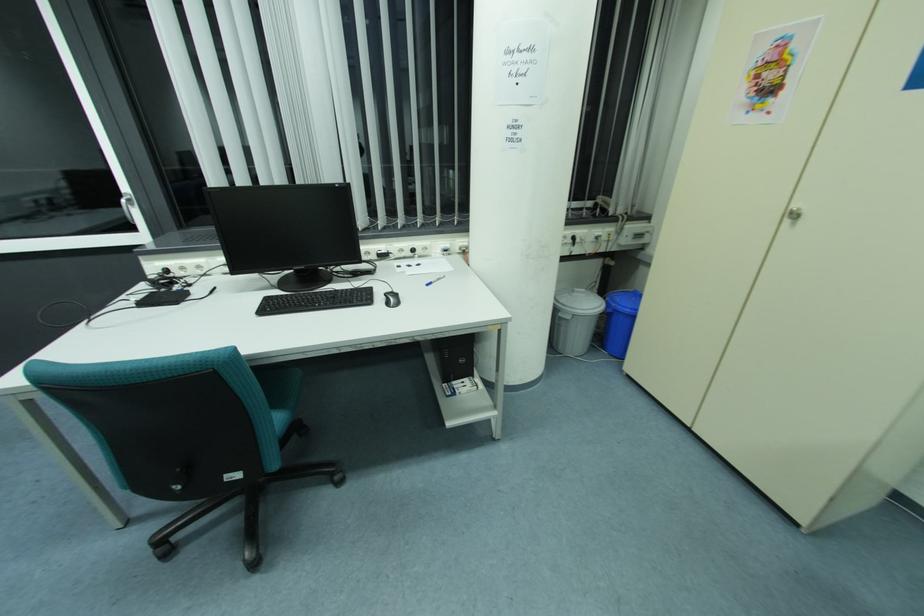
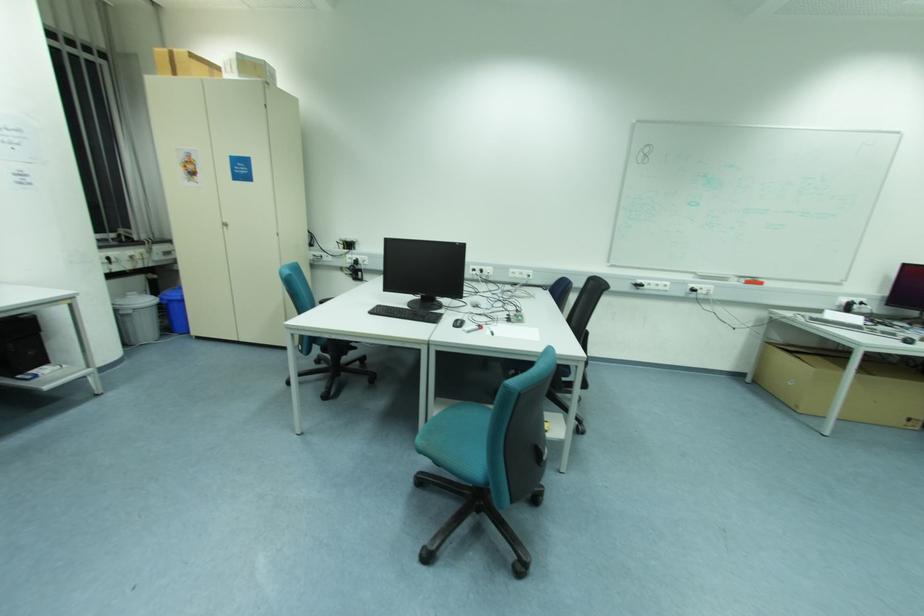
In the second image, find the point that corresponds to pixel 795 216 in the first image.

(226, 225)